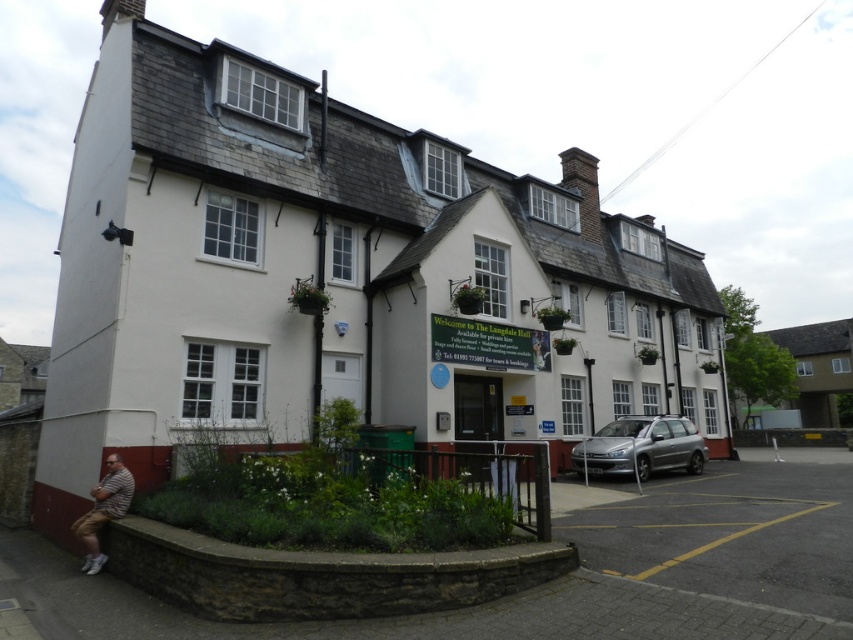
This screenshot has height=640, width=853. I want to click on satin silver car at lower right, so click(x=641, y=445).

Is satin silver car at lower right thinner than striped fabric at lower left?

In fact, satin silver car at lower right might be wider than striped fabric at lower left.

Identify the location of satin silver car at lower right. (641, 445).